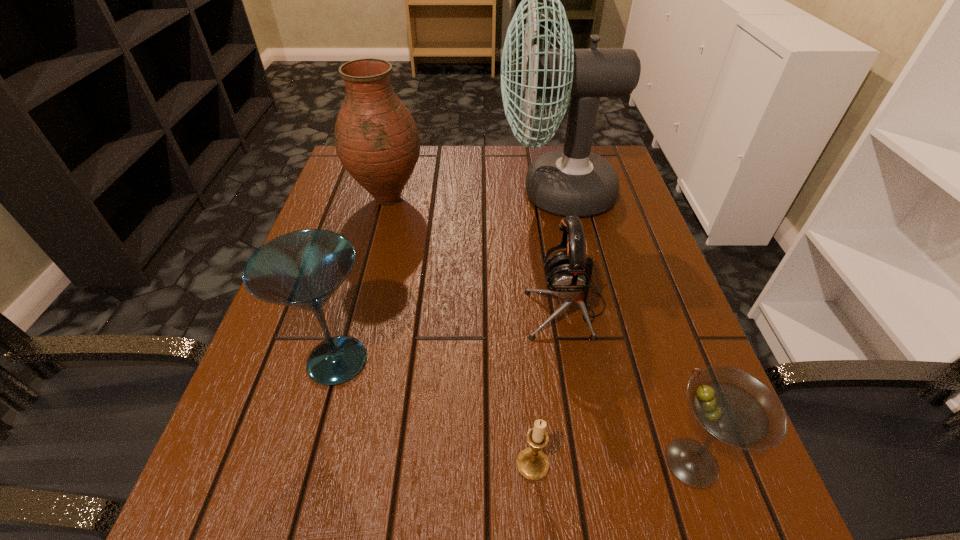
What are the coordinates of `martini that is at the left edge` in the screenshot? It's located at (302, 269).

What are the coordinates of `fan that is at the right edge` in the screenshot? It's located at (573, 181).

The height and width of the screenshot is (540, 960). Find the location of `earphone situated at the right edge`. earphone situated at the right edge is located at coordinates (569, 272).

Identify the location of martini present at the right edge. The height and width of the screenshot is (540, 960). (733, 406).

Image resolution: width=960 pixels, height=540 pixels. Identify the location of object located at the far left corner. (377, 140).

The image size is (960, 540). Find the location of `object that is at the far right corner`. object that is at the far right corner is located at coordinates (573, 181).

Locate an element on the screen. Image resolution: width=960 pixels, height=540 pixels. object that is at the near right corner is located at coordinates (733, 406).

The image size is (960, 540). In the image, there is a desktop. What are the coordinates of `vacant space at the far edge` in the screenshot? It's located at (430, 148).

Where is `vacant space at the left edge of the desktop`? This screenshot has height=540, width=960. vacant space at the left edge of the desktop is located at coordinates (373, 198).

Where is `vacant space at the right edge of the desktop`? This screenshot has height=540, width=960. vacant space at the right edge of the desktop is located at coordinates (657, 480).